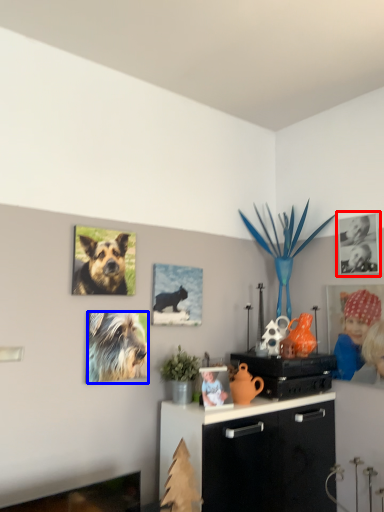
Question: Among these objects, which one is farthest to the camera, picture frame (highlighted by a red box) or dog (highlighted by a blue box)?

Choices:
 (A) picture frame
 (B) dog

Answer: (A)